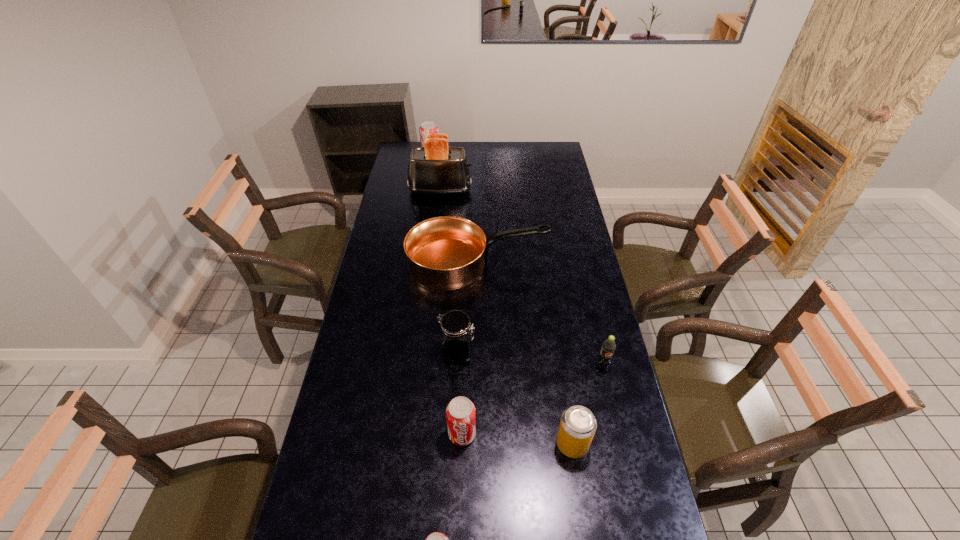
Locate which object is the fourth closest to the second smallest red soda can. Please provide its 2D coordinates. Your answer should be formatted as a tuple, i.e. [(x, y)], where the tuple contains the x and y coordinates of a point satisfying the conditions above.

[(608, 347)]

Locate which object ranks in proximity to the jar. Please provide its 2D coordinates. Your answer should be formatted as a tuple, i.e. [(x, y)], where the tuple contains the x and y coordinates of a point satisfying the conditions above.

[(461, 415)]

The width and height of the screenshot is (960, 540). In order to click on soda can that is the second closest to the leftmost red soda can in this screenshot , I will do `click(461, 415)`.

Where is `soda can that stands as the third closest to the fourth soda can from left to right`? soda can that stands as the third closest to the fourth soda can from left to right is located at coordinates (437, 539).

Locate an element on the screen. This screenshot has height=540, width=960. red soda can that is the closest to the nearest red soda can is located at coordinates (461, 415).

Select which red soda can appears as the closest to the sixth nearest object. Please provide its 2D coordinates. Your answer should be formatted as a tuple, i.e. [(x, y)], where the tuple contains the x and y coordinates of a point satisfying the conditions above.

[(461, 415)]

I want to click on vacant space that satisfies the following two spatial constraints: 1. on the side of the gray toaster with the control lever; 2. on the left side of the second soda can from right to left, so click(x=412, y=444).

Where is `vacant position in the image that satisfies the following two spatial constraints: 1. on the side of the tallest object with the control lever; 2. on the left side of the second soda can from right to left`? vacant position in the image that satisfies the following two spatial constraints: 1. on the side of the tallest object with the control lever; 2. on the left side of the second soda can from right to left is located at coordinates (412, 444).